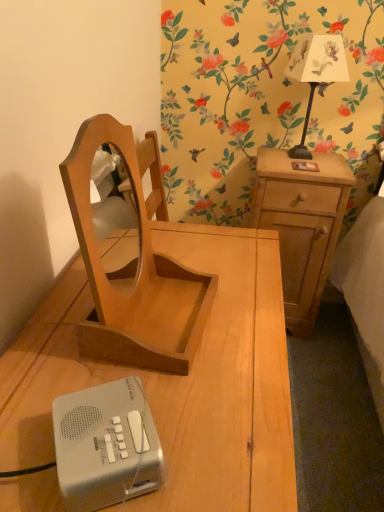
Question: Does light brown wood mirror at center have a greater height compared to white paper lampshade at upper right?

Choices:
 (A) yes
 (B) no

Answer: (B)

Question: Does light brown wood mirror at center have a greater width compared to white paper lampshade at upper right?

Choices:
 (A) yes
 (B) no

Answer: (B)

Question: Is light brown wood mirror at center in front of white paper lampshade at upper right?

Choices:
 (A) no
 (B) yes

Answer: (B)

Question: Is light brown wood mirror at center behind white paper lampshade at upper right?

Choices:
 (A) no
 (B) yes

Answer: (A)

Question: Is light brown wood mirror at center beside white paper lampshade at upper right?

Choices:
 (A) no
 (B) yes

Answer: (A)

Question: Is white paper lampshade at upper right bigger or smaller than light brown wood mirror at center?

Choices:
 (A) small
 (B) big

Answer: (B)

Question: Based on their positions, is white paper lampshade at upper right located to the left or right of light brown wood mirror at center?

Choices:
 (A) right
 (B) left

Answer: (A)

Question: Is white paper lampshade at upper right taller or shorter than light brown wood mirror at center?

Choices:
 (A) short
 (B) tall

Answer: (B)

Question: From a real-world perspective, is white paper lampshade at upper right above or below light brown wood mirror at center?

Choices:
 (A) above
 (B) below

Answer: (A)

Question: In the image, is light brown wood at right, which is the 2th nightstand from left to right, on the left side or the right side of light brown wood mirror at center?

Choices:
 (A) left
 (B) right

Answer: (B)

Question: Does point (301, 286) appear closer or farther from the camera than point (150, 278)?

Choices:
 (A) closer
 (B) farther

Answer: (B)

Question: Is light brown wood at right, the 1th nightstand in the right-to-left sequence, wider or thinner than light brown wood mirror at center?

Choices:
 (A) wide
 (B) thin

Answer: (A)

Question: Is light brown wood at right, the first nightstand viewed from the back, inside or outside of light brown wood mirror at center?

Choices:
 (A) inside
 (B) outside

Answer: (B)

Question: Looking at the image, does silver plastic radio at lower left seem bigger or smaller compared to light brown wood at right, the second nightstand positioned from the front?

Choices:
 (A) big
 (B) small

Answer: (B)

Question: From the image's perspective, relative to light brown wood at right, which is the 2th nightstand from left to right, is silver plastic radio at lower left above or below?

Choices:
 (A) below
 (B) above

Answer: (A)